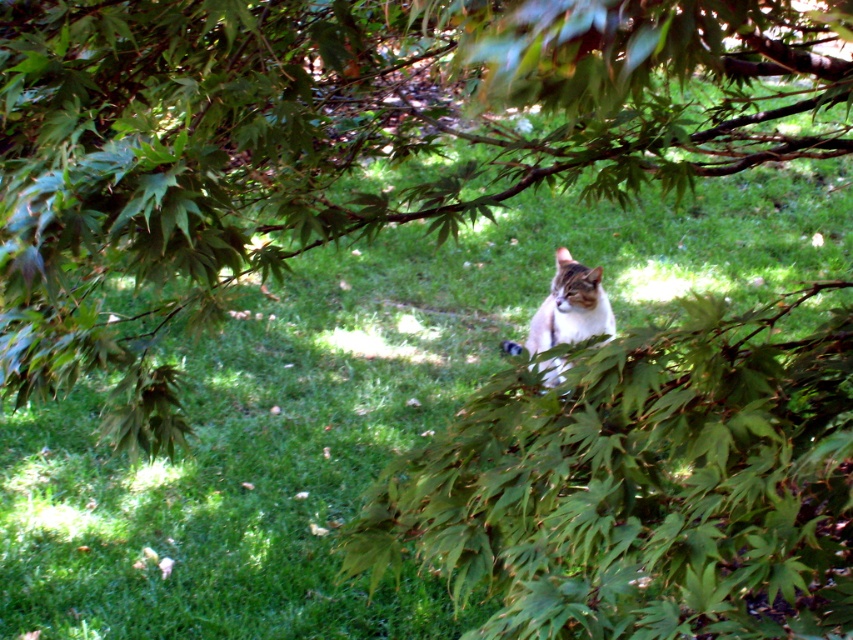
Between green leafy tree at center and green leafy bush at center, which one appears on the right side from the viewer's perspective?

green leafy bush at center

Who is taller, green leafy tree at center or green leafy bush at center?

green leafy tree at center

What are the coordinates of `green leafy tree at center` in the screenshot? It's located at (345, 141).

Find the location of a particular element. The height and width of the screenshot is (640, 853). green leafy tree at center is located at coordinates (345, 141).

Is point (126, 141) behind point (544, 316)?

That is False.

Who is lower down, green leafy tree at center or tabby fur cat at center?

Positioned lower is tabby fur cat at center.

This screenshot has width=853, height=640. I want to click on green leafy tree at center, so click(x=345, y=141).

Find the location of a particular element. This screenshot has width=853, height=640. green leafy tree at center is located at coordinates (345, 141).

Is green leafy bush at center to the left of tabby fur cat at center from the viewer's perspective?

Correct, you'll find green leafy bush at center to the left of tabby fur cat at center.

Is point (546, 490) behind point (567, 259)?

No, it is not.

Is point (830, 461) farther from camera compared to point (554, 310)?

That is False.

Identify the location of green leafy bush at center. Image resolution: width=853 pixels, height=640 pixels. (643, 486).